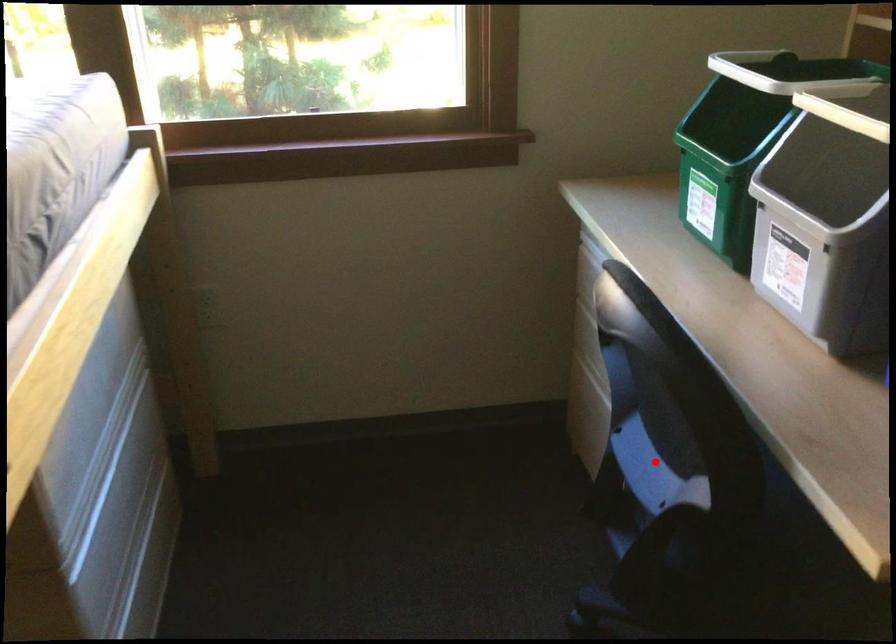
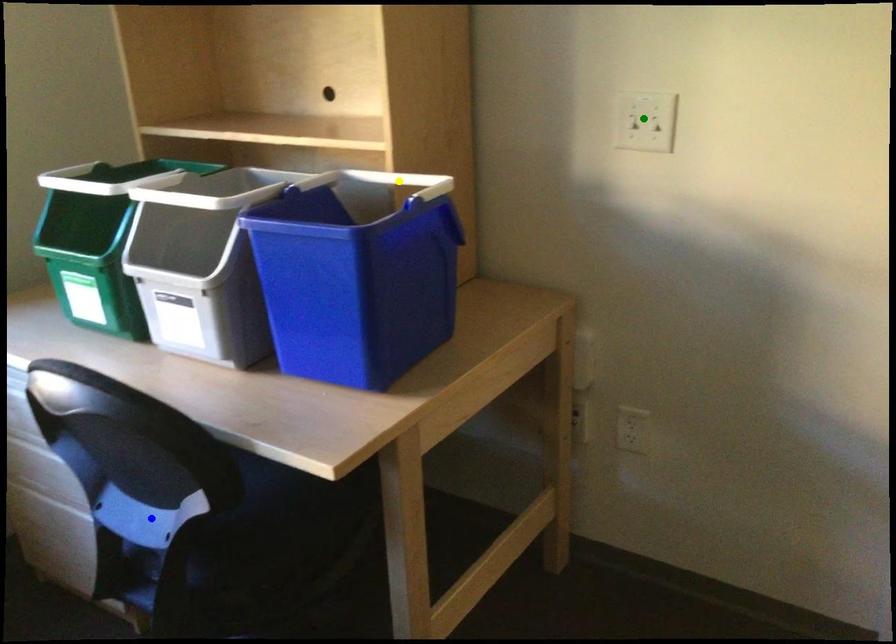
Question: I am providing you with two images of the same scene from different viewpoints. A red point is marked on the first image. You are given multiple points on the second image. Which point in image 2 is actually the same real-world point as the red point in image 1?

Choices:
 (A) green point
 (B) blue point
 (C) yellow point

Answer: (B)